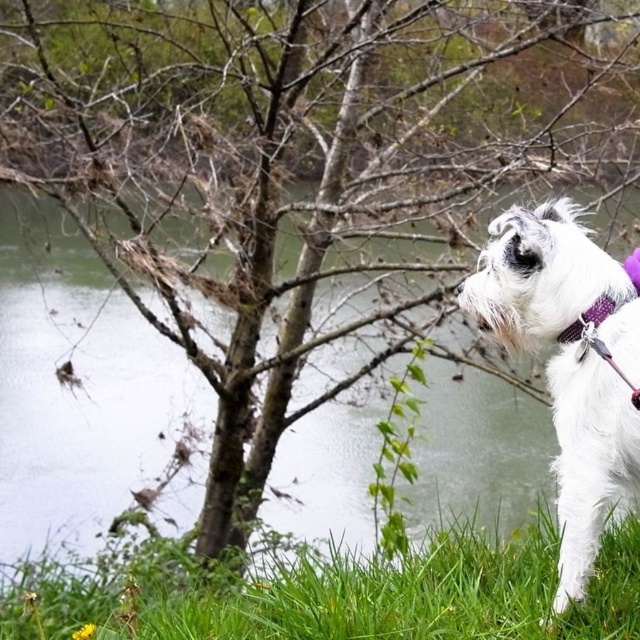
Question: Which object is the closest to the purple fabric collar at right?

Choices:
 (A) white fur dog at right
 (B) green grass at lower right

Answer: (A)

Question: Is green grass at lower right smaller than purple fabric collar at right?

Choices:
 (A) yes
 (B) no

Answer: (B)

Question: Among these points, which one is farthest from the camera?

Choices:
 (A) (564, 326)
 (B) (468, 568)

Answer: (B)

Question: Does white fur dog at right have a smaller size compared to purple fabric collar at right?

Choices:
 (A) yes
 (B) no

Answer: (B)

Question: Which of these objects is positioned closest to the white fur dog at right?

Choices:
 (A) green grass at lower right
 (B) purple fabric collar at right

Answer: (B)

Question: Can you confirm if green grass at lower right is bigger than white fur dog at right?

Choices:
 (A) yes
 (B) no

Answer: (A)